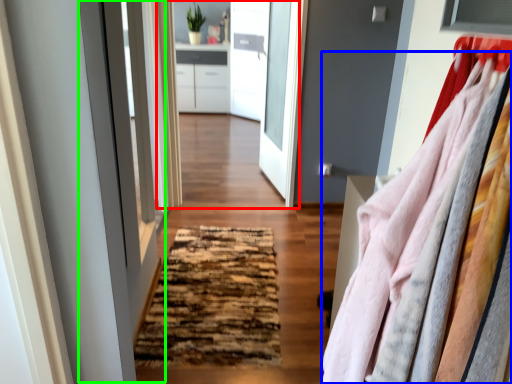
Question: Estimate the real-world distances between objects in this image. Which object is closer to clothing store (highlighted by a red box), clothing (highlighted by a blue box) or screen door (highlighted by a green box)?

Choices:
 (A) clothing
 (B) screen door

Answer: (B)